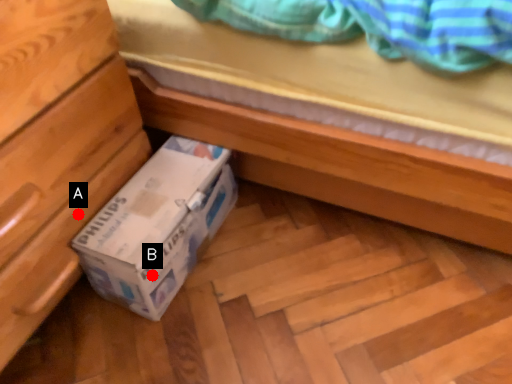
Question: Two points are circled on the image, labeled by A and B beside each circle. Among these points, which one is farthest from the camera?

Choices:
 (A) A is further
 (B) B is further

Answer: (A)